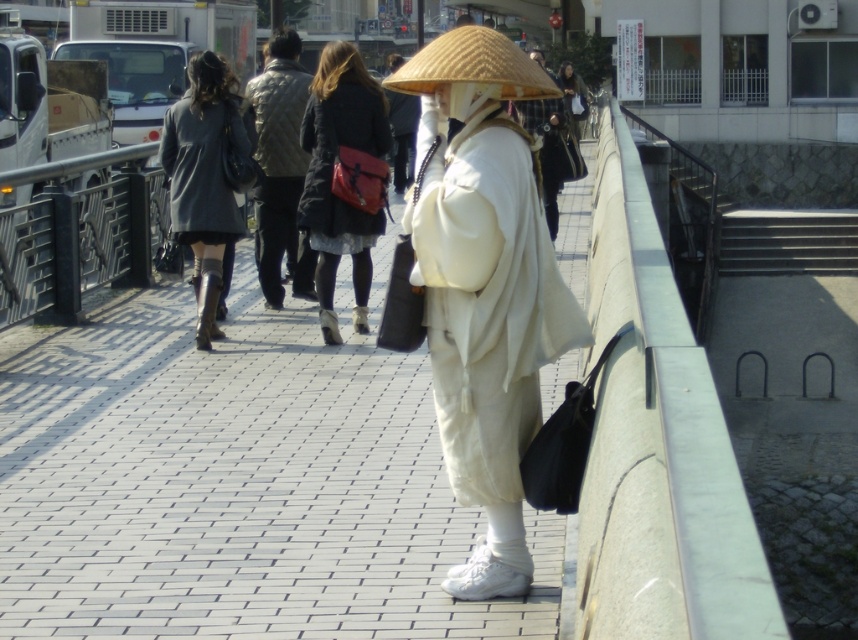
You are standing on a pedestrian bridge in a Japanese city and see the white matte kimono at center. If you want to take a photo of the kimono without any obstructions, where should you position yourself relative to the kimono?

To take a photo of the white matte kimono at center without obstructions, position yourself directly in front of it, as its coordinates at point (485, 285) indicate it is centrally located with clear space around it.

You are a photographer trying to capture the person in the white matte kimono at center and the natural straw hat at center. Since you want to focus on the kimono, which object should you adjust your camera to prioritize in the frame?

You should prioritize the white matte kimono at center because it is in front of the natural straw hat at center, making it closer to the camera and thus easier to focus on.